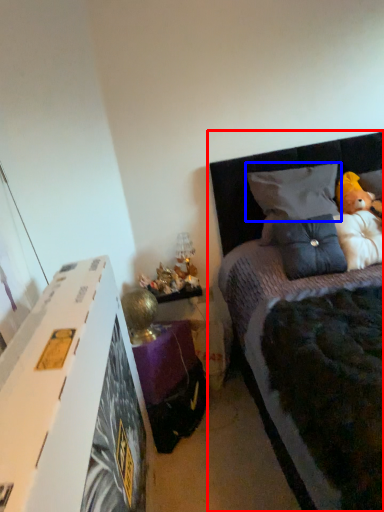
Question: Which object appears farthest to the camera in this image, bed (highlighted by a red box) or pillow (highlighted by a blue box)?

Choices:
 (A) bed
 (B) pillow

Answer: (B)